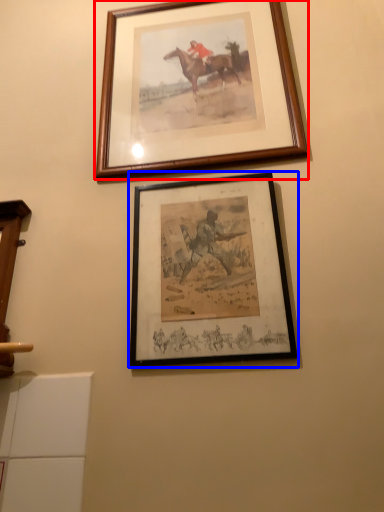
Question: Which object appears closest to the camera in this image, picture frame (highlighted by a red box) or picture frame (highlighted by a blue box)?

Choices:
 (A) picture frame
 (B) picture frame

Answer: (B)